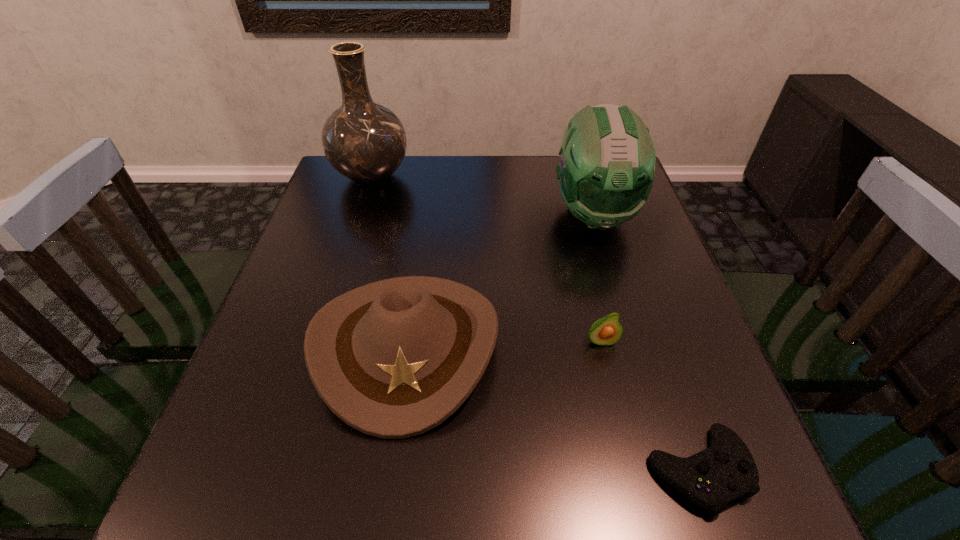
Find the location of `the tallest object`. the tallest object is located at coordinates (364, 141).

This screenshot has width=960, height=540. I want to click on the fourth shortest object, so click(607, 158).

This screenshot has width=960, height=540. I want to click on cowboy hat, so click(395, 358).

At what (x,y) coordinates should I click in order to perform the action: click on the second shortest object. Please return your answer as a coordinate pair (x, y). The height and width of the screenshot is (540, 960). Looking at the image, I should click on (606, 331).

This screenshot has height=540, width=960. In order to click on control in this screenshot , I will do `click(712, 478)`.

Locate an element on the screen. The height and width of the screenshot is (540, 960). free space located 0.180m on the right of the tallest object is located at coordinates (472, 176).

Where is `free point located on the visor of the football helmet`? This screenshot has height=540, width=960. free point located on the visor of the football helmet is located at coordinates (613, 279).

This screenshot has height=540, width=960. In order to click on free space located 0.120m on the cut side of the avocado in this screenshot , I will do `click(617, 406)`.

This screenshot has height=540, width=960. I want to click on free point located 0.320m on the left of the control, so click(445, 470).

The height and width of the screenshot is (540, 960). I want to click on vase that is at the far edge, so click(364, 141).